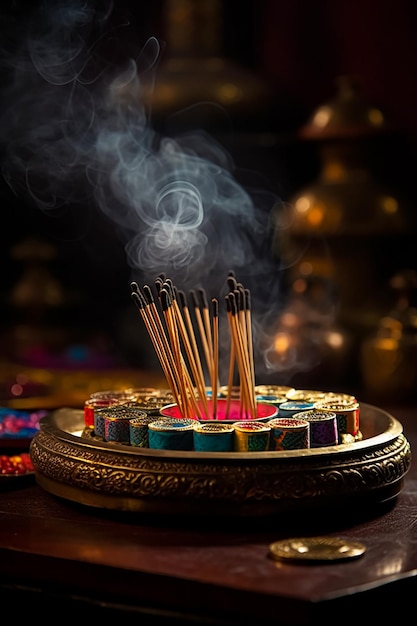
This screenshot has width=417, height=626. Identify the location of bottom of the table. (21, 598), (73, 600), (158, 620), (390, 618).